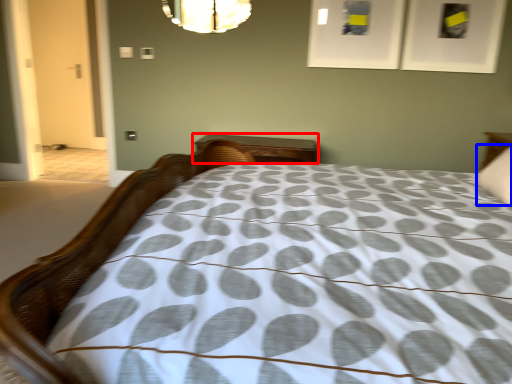
Question: Among these objects, which one is farthest to the camera, nightstand (highlighted by a red box) or pillow (highlighted by a blue box)?

Choices:
 (A) nightstand
 (B) pillow

Answer: (A)